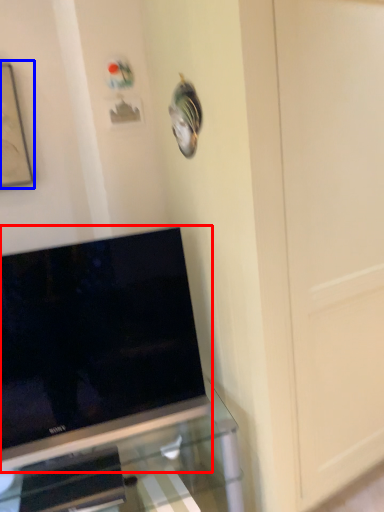
Question: Which of the following is the closest to the observer, television (highlighted by a red box) or picture frame (highlighted by a blue box)?

Choices:
 (A) television
 (B) picture frame

Answer: (A)